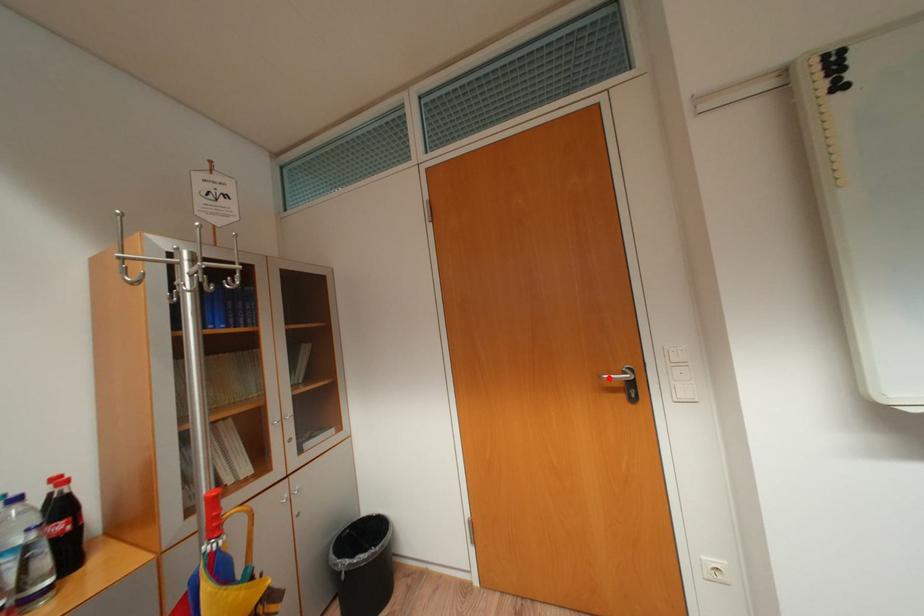
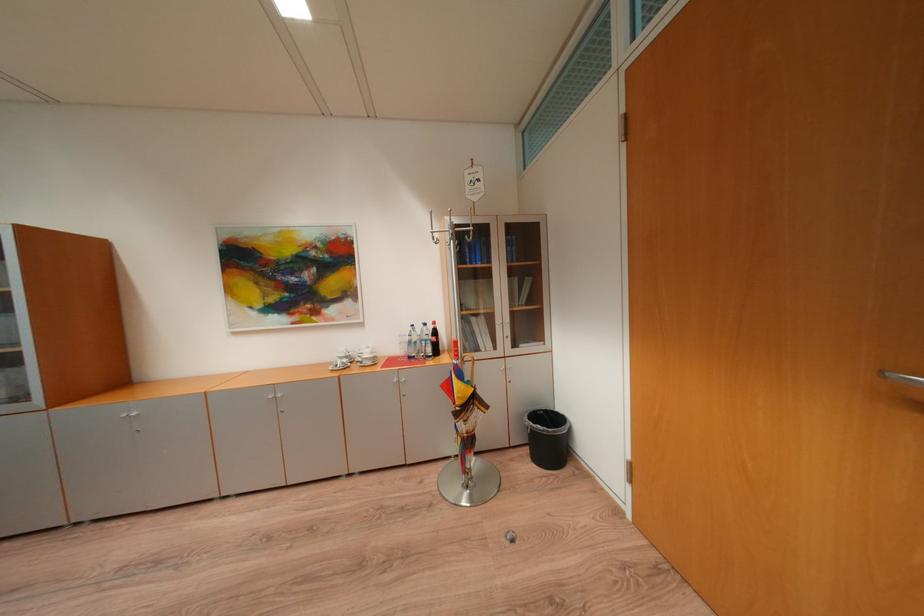
Find the pixel in the second image that matches the highlighted location in the first image.

(891, 374)